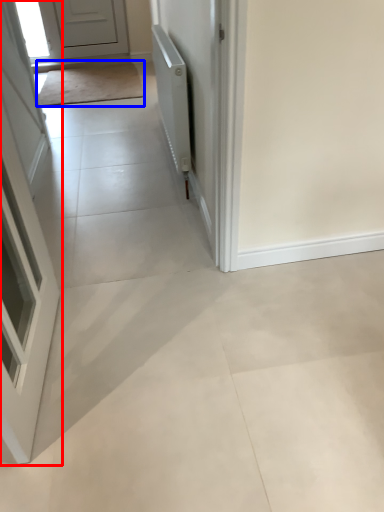
Question: Which object is further to the camera taking this photo, door (highlighted by a red box) or mat (highlighted by a blue box)?

Choices:
 (A) door
 (B) mat

Answer: (B)